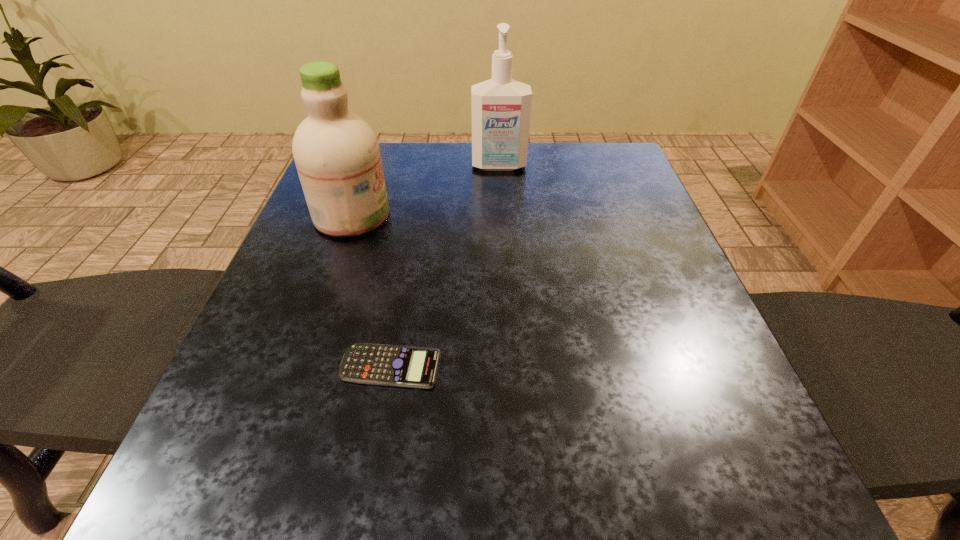
Where is `free space between the second nearest object and the farther cleansing agent`? Image resolution: width=960 pixels, height=540 pixels. free space between the second nearest object and the farther cleansing agent is located at coordinates (425, 191).

I want to click on unoccupied area between the calculator and the left cleansing agent, so click(x=371, y=291).

At what (x,y) coordinates should I click in order to perform the action: click on vacant space that's between the shortest object and the left cleansing agent. Please return your answer as a coordinate pair (x, y). The width and height of the screenshot is (960, 540). Looking at the image, I should click on (371, 291).

Locate an element on the screen. vacant point located between the nearest object and the right cleansing agent is located at coordinates (444, 266).

Where is `free spot between the second farthest object and the rightmost object`? free spot between the second farthest object and the rightmost object is located at coordinates (425, 191).

At what (x,y) coordinates should I click in order to perform the action: click on vacant area that lies between the farther cleansing agent and the left cleansing agent. Please return your answer as a coordinate pair (x, y). The image size is (960, 540). Looking at the image, I should click on (425, 191).

Locate an element on the screen. vacant area between the right cleansing agent and the left cleansing agent is located at coordinates (425, 191).

The image size is (960, 540). I want to click on the second closest object to the farthest object, so click(x=377, y=364).

You are a GUI agent. You are given a task and a screenshot of the screen. Output one action in this format:
    pyautogui.click(x=<x>, y=<y>)
    Task: Click on the second closest object to the left cleansing agent
    The height and width of the screenshot is (540, 960).
    Given the screenshot: What is the action you would take?
    pyautogui.click(x=377, y=364)

Identify the location of free space that satisfies the following two spatial constraints: 1. on the front label of the farther cleansing agent; 2. on the front label of the nearer cleansing agent. Image resolution: width=960 pixels, height=540 pixels. (502, 215).